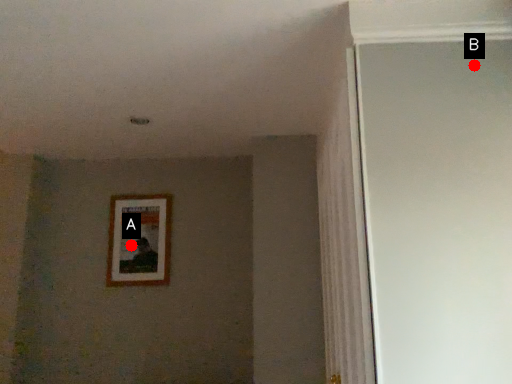
Question: Two points are circled on the image, labeled by A and B beside each circle. Which of the following is the farthest from the observer?

Choices:
 (A) A is further
 (B) B is further

Answer: (A)